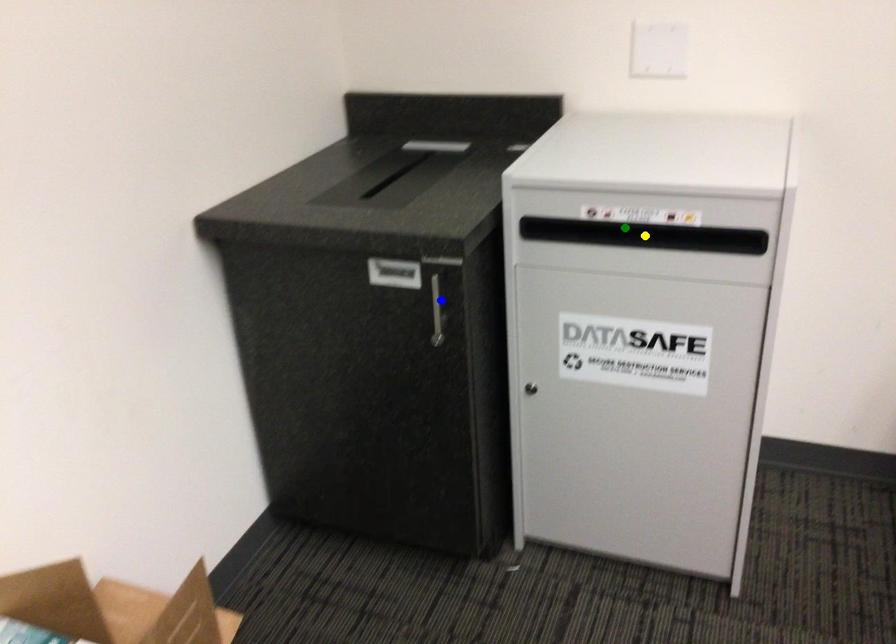
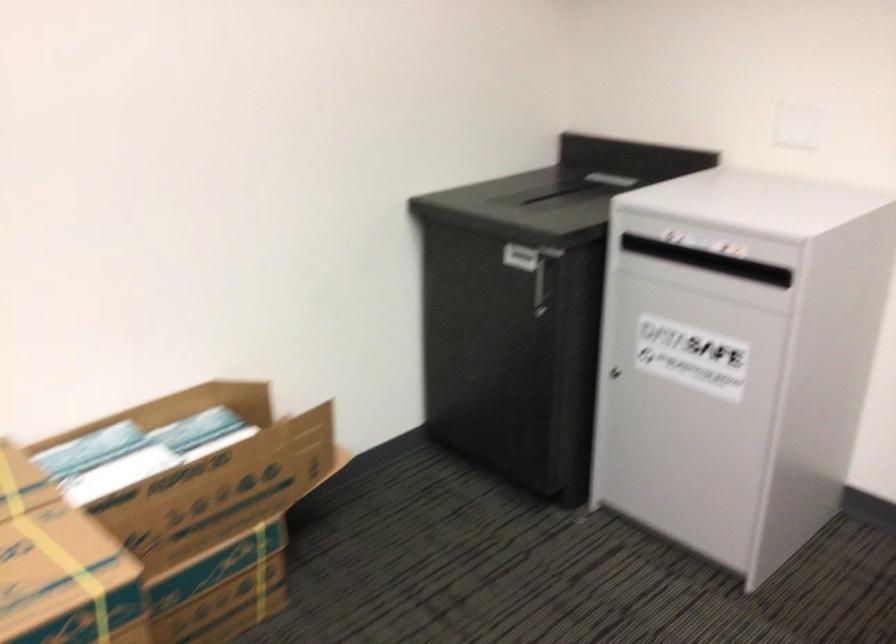
I am providing you with two images of the same scene from different viewpoints. Three points are marked in image1. Which point corresponds to a part or object that is occluded in image2?In image1, three points are marked. Which of them correspond to a part or object that is occluded in image2?Among the three points shown in image1, which one corresponds to a part or object that is no longer visible due to occlusion in image2?

Invisible in image2: yellow point.